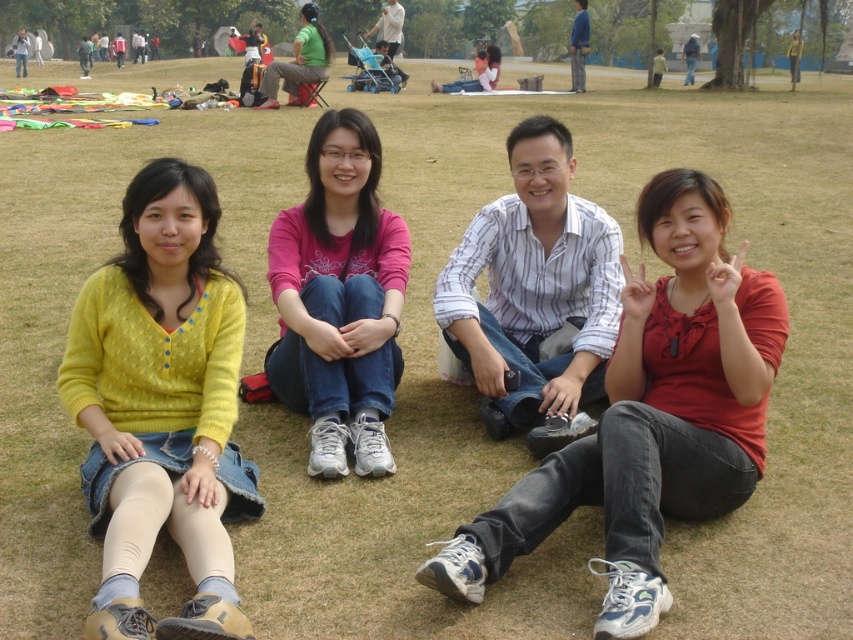
Question: Which of the following is the closest to the observer?

Choices:
 (A) green matte shirt at upper center
 (B) matte red shirt at center
 (C) yellow knitted sweater at left
 (D) white striped shirt at center

Answer: (C)

Question: Is the position of matte red shirt at center less distant than that of yellow knitted sweater at left?

Choices:
 (A) yes
 (B) no

Answer: (B)

Question: Observing the image, what is the correct spatial positioning of yellow knitted sweater at left in reference to green matte shirt at upper center?

Choices:
 (A) right
 (B) left

Answer: (A)

Question: Does white striped shirt at center appear over green matte shirt at upper center?

Choices:
 (A) yes
 (B) no

Answer: (B)

Question: Estimate the real-world distances between objects in this image. Which object is closer to the yellow knitted sweater at left?

Choices:
 (A) white striped shirt at center
 (B) pink fabric shirt at center
 (C) green matte shirt at upper center

Answer: (B)

Question: Among these points, which one is farthest from the camera?

Choices:
 (A) (679, 358)
 (B) (303, 74)
 (C) (70, 378)

Answer: (B)